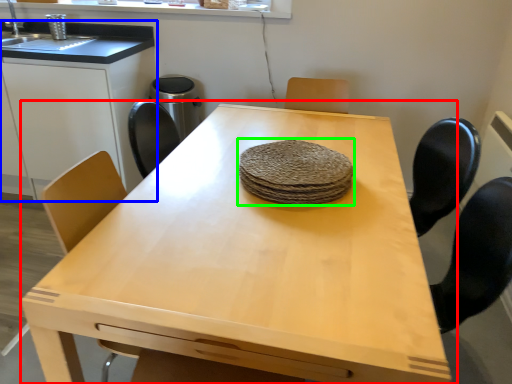
Question: Estimate the real-world distances between objects in this image. Which object is closer to table (highlighted by a red box), cabinetry (highlighted by a blue box) or food (highlighted by a green box)?

Choices:
 (A) cabinetry
 (B) food

Answer: (B)